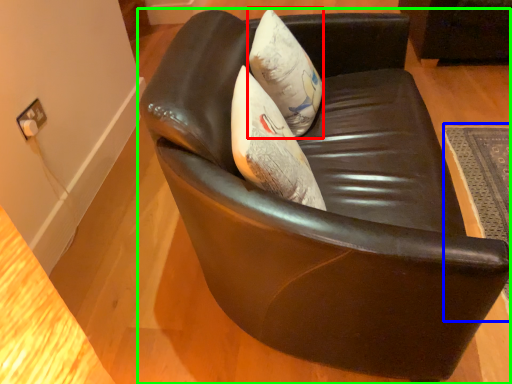
Question: Based on their relative distances, which object is nearer to throw pillow (highlighted by a red box)? Choose from mat (highlighted by a blue box) and chair (highlighted by a green box).

Choices:
 (A) mat
 (B) chair

Answer: (B)